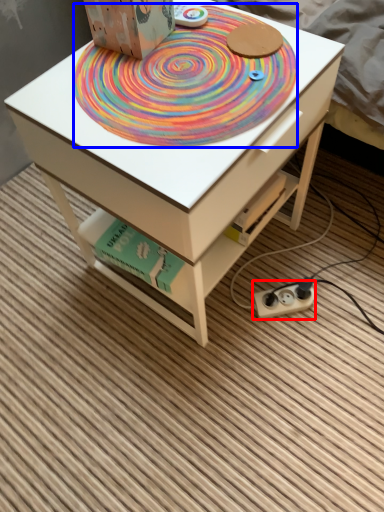
Question: Which of the following is the closest to the observer, plug (highlighted by a red box) or mat (highlighted by a blue box)?

Choices:
 (A) plug
 (B) mat

Answer: (B)